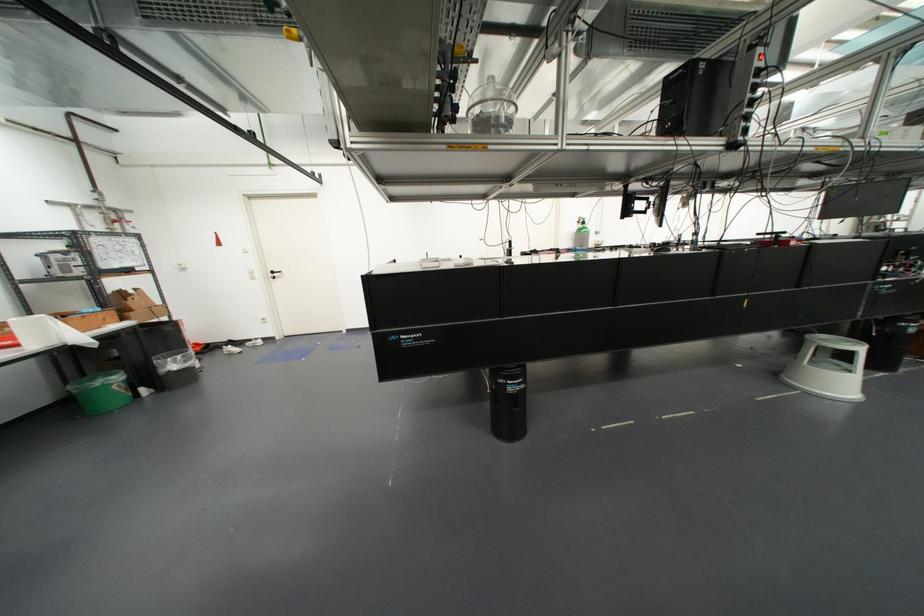
Find where to lift the cardboard box. Please return your answer as a coordinate pair (x, y).

(90, 318)